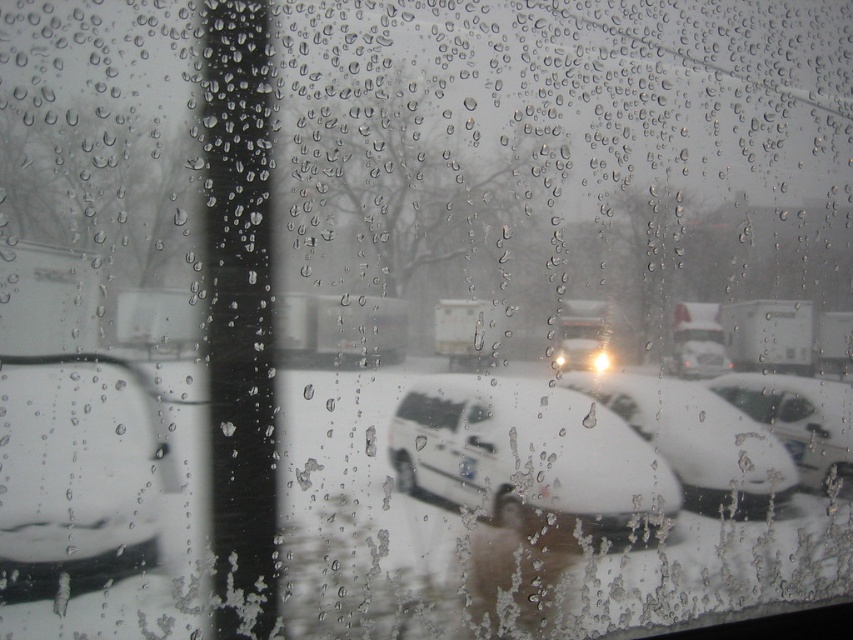
Question: Which point is closer to the camera?

Choices:
 (A) white matte car at left
 (B) white matte van at center
 (C) white matte car at center
 (D) white matte car at right

Answer: (A)

Question: Considering the real-world distances, which object is farthest from the white matte car at center?

Choices:
 (A) white matte car at left
 (B) white matte van at center

Answer: (A)

Question: Can you confirm if white matte car at center is wider than white matte car at right?

Choices:
 (A) yes
 (B) no

Answer: (A)

Question: Considering the relative positions of white matte car at left and white matte car at center in the image provided, where is white matte car at left located with respect to white matte car at center?

Choices:
 (A) right
 (B) left

Answer: (B)

Question: In this image, where is white matte car at left located relative to white matte car at center?

Choices:
 (A) below
 (B) above

Answer: (A)

Question: Which object appears closest to the camera in this image?

Choices:
 (A) white matte car at center
 (B) white matte car at left
 (C) white matte van at center
 (D) white matte car at right

Answer: (B)